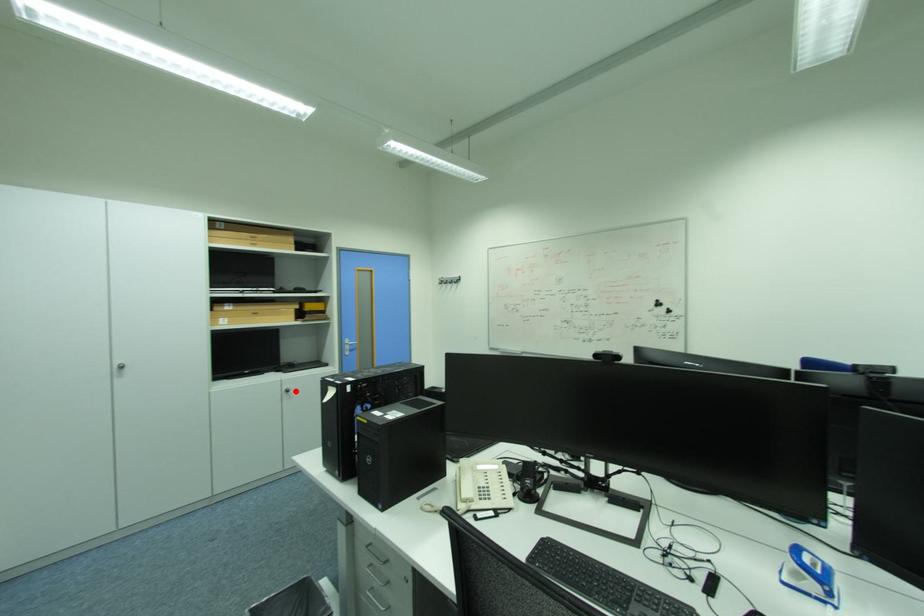
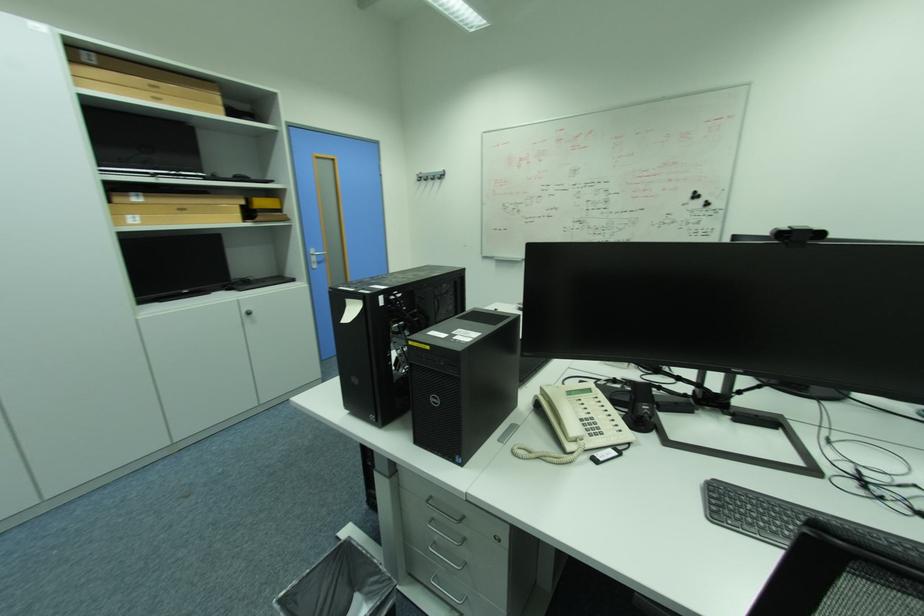
Question: I am providing you with two images of the same scene from different viewpoints. A red point is shown in image1. For the corresponding object point in image2, is it positioned nearer or farther from the camera?

Choices:
 (A) Nearer
 (B) Farther

Answer: (A)